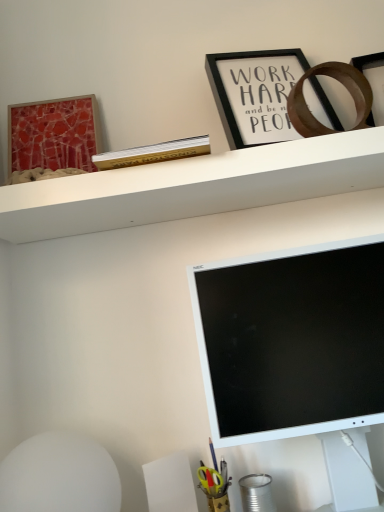
Question: From a real-world perspective, is white matte shelf at upper center below metallic tin can at lower right?

Choices:
 (A) yes
 (B) no

Answer: (B)

Question: Does white matte shelf at upper center have a greater width compared to metallic tin can at lower right?

Choices:
 (A) no
 (B) yes

Answer: (B)

Question: Is white matte shelf at upper center to the right of metallic tin can at lower right from the viewer's perspective?

Choices:
 (A) no
 (B) yes

Answer: (A)

Question: Can you confirm if white matte shelf at upper center is taller than metallic tin can at lower right?

Choices:
 (A) no
 (B) yes

Answer: (A)

Question: Is white matte shelf at upper center located outside metallic tin can at lower right?

Choices:
 (A) yes
 (B) no

Answer: (A)

Question: Is white matte shelf at upper center touching metallic tin can at lower right?

Choices:
 (A) no
 (B) yes

Answer: (A)

Question: Is black matte picture frame at upper center, the first picture frame when ordered from right to left, located within white matte shelf at upper center?

Choices:
 (A) no
 (B) yes

Answer: (A)

Question: Are white matte shelf at upper center and black matte picture frame at upper center, the first picture frame when ordered from right to left, located far from each other?

Choices:
 (A) yes
 (B) no

Answer: (B)

Question: Considering the relative sizes of white matte shelf at upper center and black matte picture frame at upper center, placed as the second picture frame when sorted from left to right, in the image provided, is white matte shelf at upper center shorter than black matte picture frame at upper center, placed as the second picture frame when sorted from left to right,?

Choices:
 (A) yes
 (B) no

Answer: (A)

Question: Is white matte shelf at upper center completely or partially outside of black matte picture frame at upper center, the first picture frame when ordered from right to left?

Choices:
 (A) yes
 (B) no

Answer: (A)

Question: Can you confirm if white matte shelf at upper center is smaller than black matte picture frame at upper center, placed as the second picture frame when sorted from left to right?

Choices:
 (A) no
 (B) yes

Answer: (A)

Question: Considering the relative sizes of white matte shelf at upper center and black matte picture frame at upper center, the first picture frame when ordered from right to left, in the image provided, is white matte shelf at upper center bigger than black matte picture frame at upper center, the first picture frame when ordered from right to left,?

Choices:
 (A) no
 (B) yes

Answer: (B)

Question: Considering the relative positions of matte red picture frame at upper left, acting as the second picture frame starting from the right, and black matte picture frame at upper center, the first picture frame when ordered from right to left, in the image provided, is matte red picture frame at upper left, acting as the second picture frame starting from the right, to the right of black matte picture frame at upper center, the first picture frame when ordered from right to left, from the viewer's perspective?

Choices:
 (A) yes
 (B) no

Answer: (B)